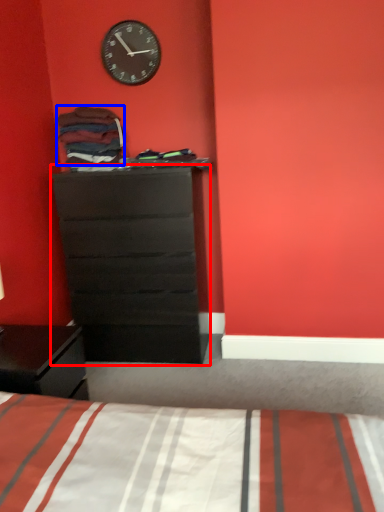
Question: Which of the following is the closest to the observer, chest of drawers (highlighted by a red box) or clothing (highlighted by a blue box)?

Choices:
 (A) chest of drawers
 (B) clothing

Answer: (A)